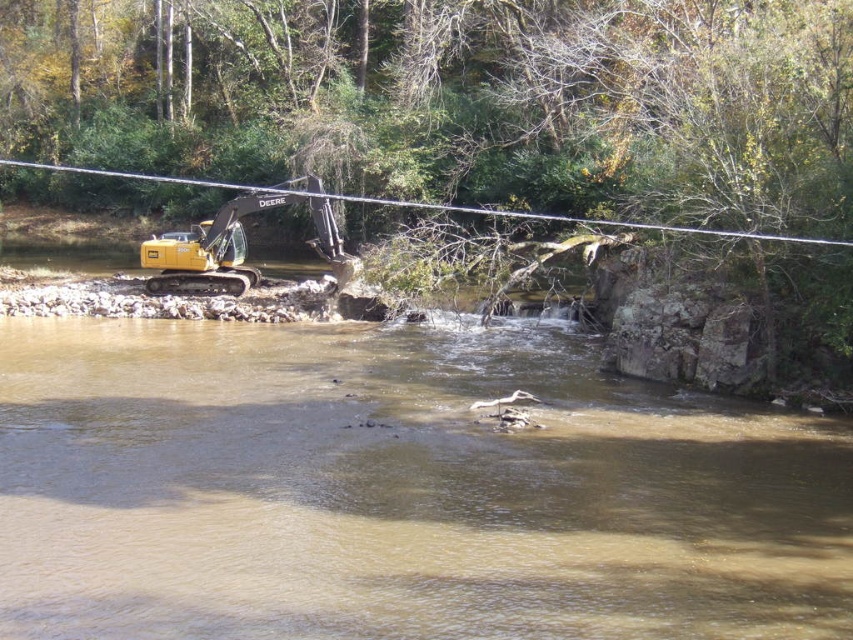
You are a construction worker who needs to cross the river to reach the other side. The yellow metallic excavator at upper left is parked on the bank. Can you safely cross the river using the area where the brown sedimentary water at left is located?

The brown sedimentary water at left has a larger width than the yellow metallic excavator at upper left. Since the excavator is on the bank, the water area might be too wide to cross safely without proper equipment.

You are a construction worker standing on the riverbank. You see the brown sedimentary water at left and the smooth wire at upper center. Which object is nearer to you?

The brown sedimentary water at left is closer to the viewer than the smooth wire at upper center.

You are a construction worker standing at the edge of the riverbank. You need to place a safety barrier that is 2 meters wide between yourself and the brown sedimentary water at left. Is there enough space to place the barrier without it overlapping with the water?

The brown sedimentary water at left is 7.87 meters from the viewer. Since the safety barrier is only 2 meters wide, there is sufficient space to place it between the worker and the water without overlapping.